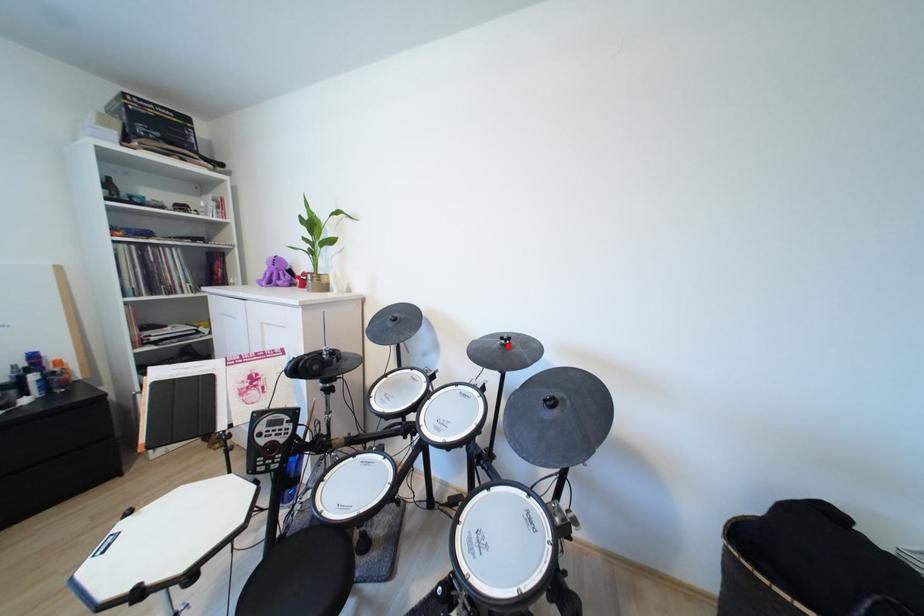
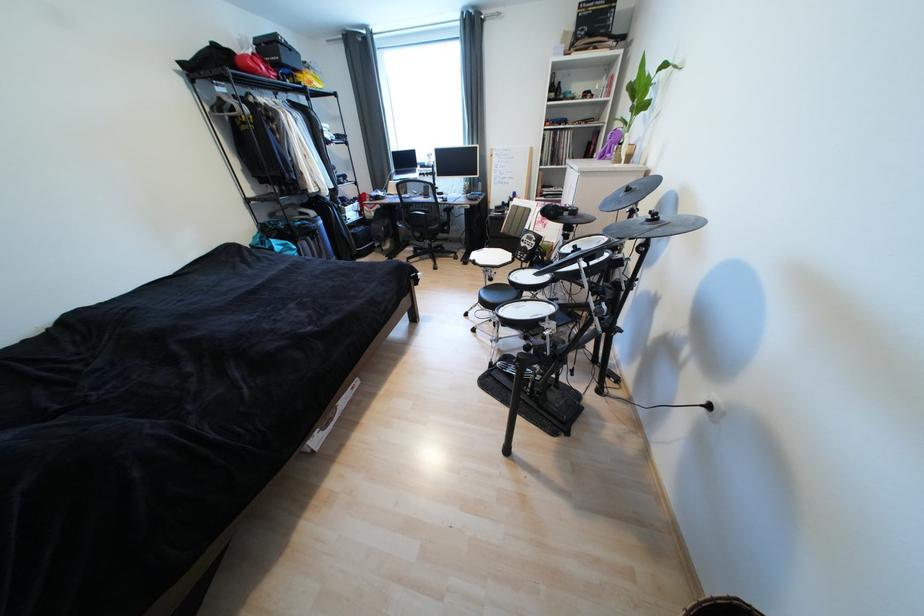
Question: I am providing you with two images of the same scene from different viewpoints. A red point is marked on the first image. Is the red point's position out of view in image 2?

Choices:
 (A) Yes
 (B) No

Answer: (B)